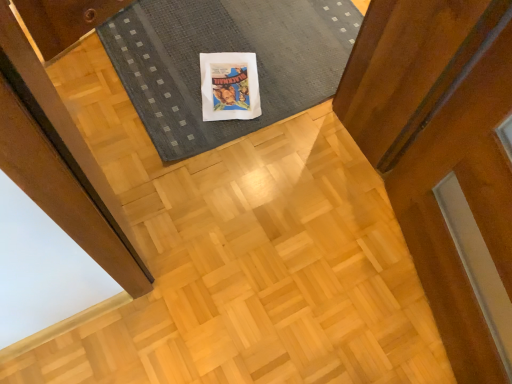
At what (x,y) coordinates should I click in order to perform the action: click on free space in front of matte white comic book at center. Please return your answer as a coordinate pair (x, y). The width and height of the screenshot is (512, 384). Looking at the image, I should click on (218, 144).